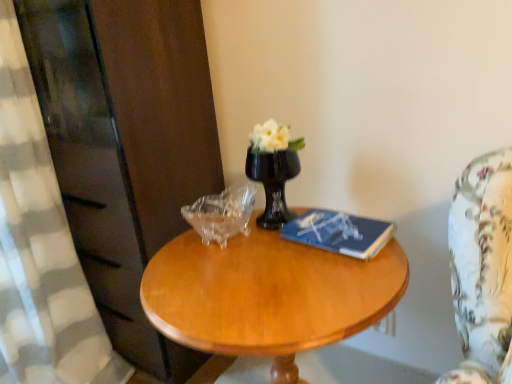
This screenshot has width=512, height=384. I want to click on unoccupied area in front of blue matte book at center, so click(331, 278).